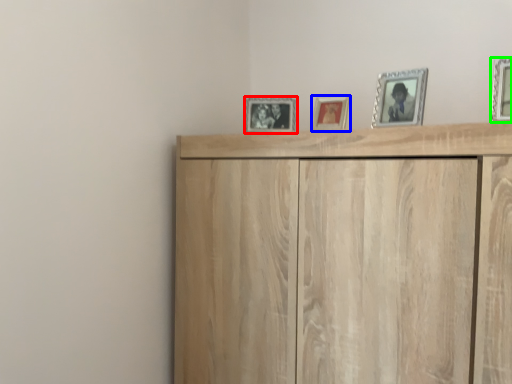
Question: Estimate the real-world distances between objects in this image. Which object is closer to picture frame (highlighted by a red box), picture frame (highlighted by a blue box) or picture frame (highlighted by a green box)?

Choices:
 (A) picture frame
 (B) picture frame

Answer: (A)